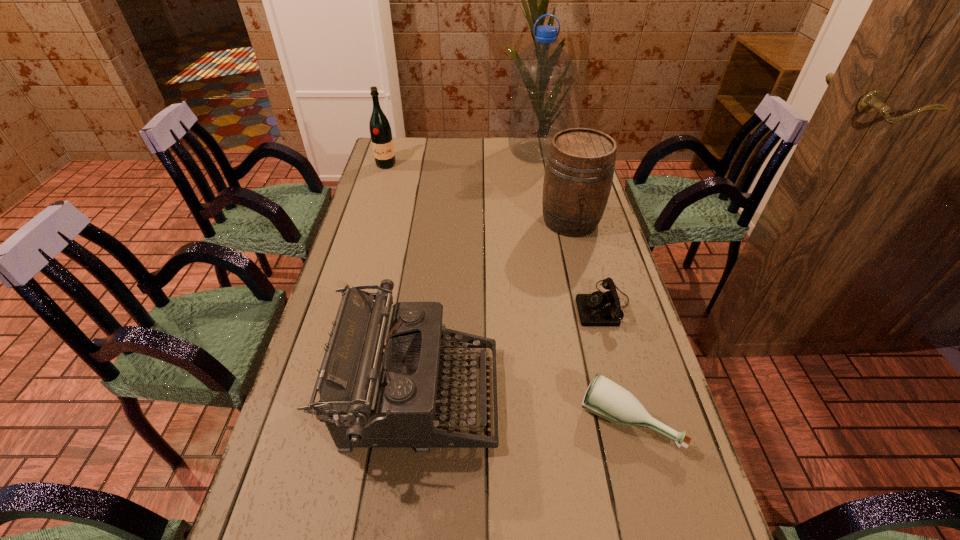
Image resolution: width=960 pixels, height=540 pixels. Identify the location of the tallest object. (542, 75).

Locate an element on the screen. liquor is located at coordinates pyautogui.click(x=380, y=131).

Where is `cider`? This screenshot has width=960, height=540. cider is located at coordinates (580, 166).

Where is `typewriter`? typewriter is located at coordinates (378, 383).

Locate an element on the screen. The image size is (960, 540). the fourth tallest object is located at coordinates (378, 383).

Find the location of a particular element. The width and height of the screenshot is (960, 540). bottle is located at coordinates (605, 398).

Locate an element on the screen. This screenshot has height=540, width=960. telephone is located at coordinates (599, 308).

You are a GUI agent. You are given a task and a screenshot of the screen. Output one action in this format:
    pyautogui.click(x=<x>, y=<y>)
    Task: Click on the vacant area situated 0.360m on the left of the tallest object
    The height and width of the screenshot is (540, 960).
    Given the screenshot: What is the action you would take?
    pyautogui.click(x=421, y=153)

Where is `vacant space located on the front-facing side of the liquor`? This screenshot has width=960, height=540. vacant space located on the front-facing side of the liquor is located at coordinates (374, 201).

The width and height of the screenshot is (960, 540). What are the coordinates of `vacant space located 0.290m on the side of the cider near the bung hole` in the screenshot? It's located at (592, 308).